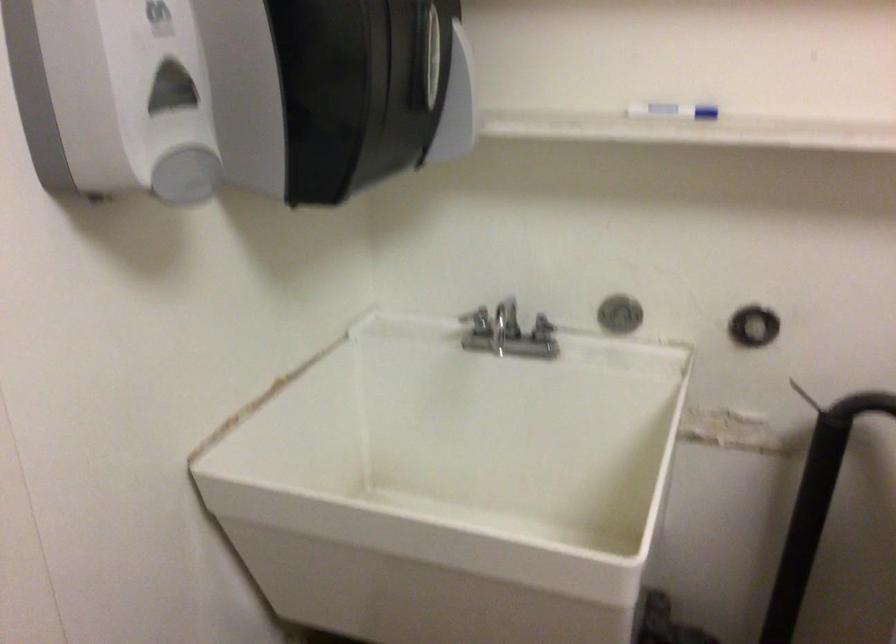
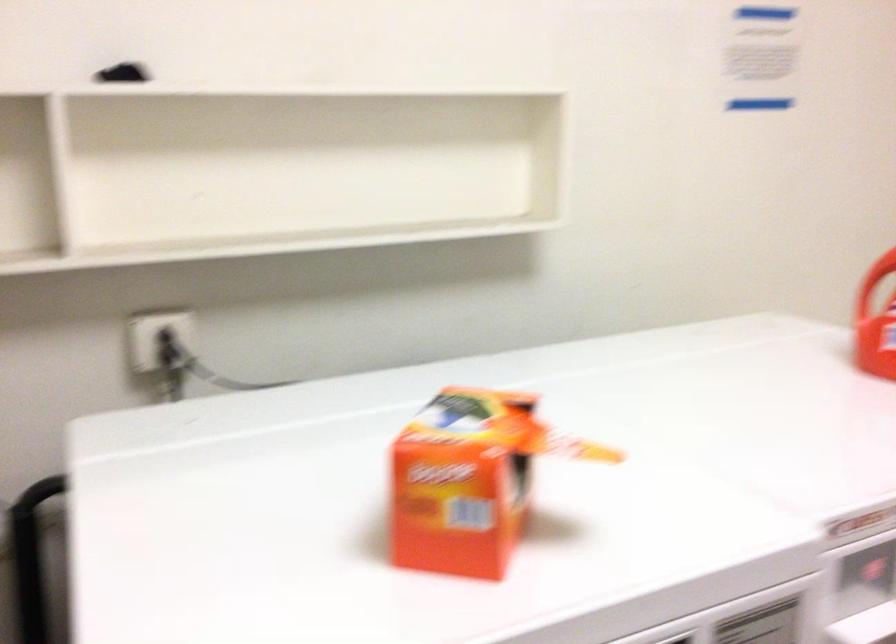
Question: The first image is from the beginning of the video and the second image is from the end. How did the camera likely rotate when shooting the video?

Choices:
 (A) Left
 (B) Right
 (C) Up
 (D) Down

Answer: (B)